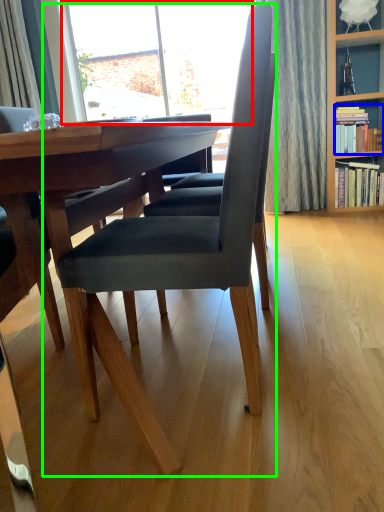
Question: Which object is the closest to the window (highlighted by a red box)? Choose among these: book (highlighted by a blue box) or chair (highlighted by a green box).

Choices:
 (A) book
 (B) chair

Answer: (A)